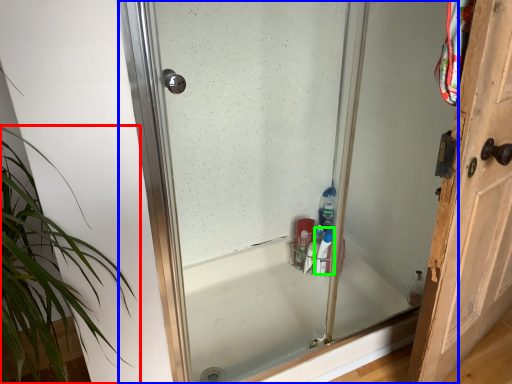
Question: Based on their relative distances, which object is nearer to houseplant (highlighted by a red box)? Choose from glass door (highlighted by a blue box) and cleaning product (highlighted by a green box).

Choices:
 (A) glass door
 (B) cleaning product

Answer: (A)